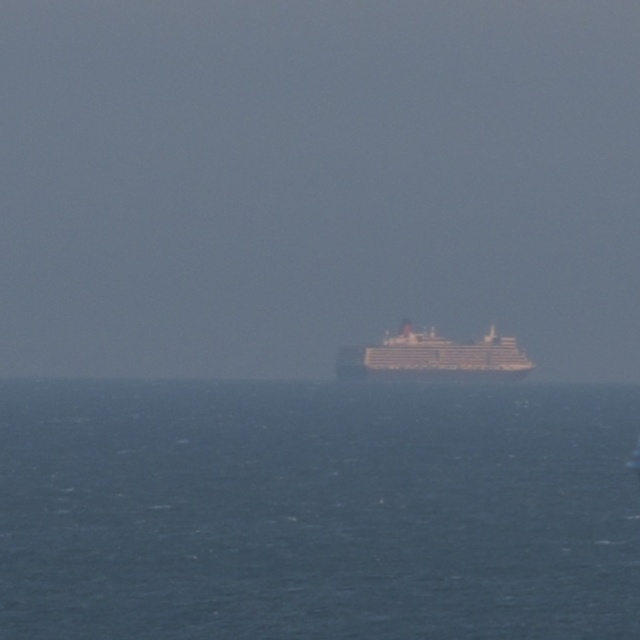
Question: Is blue water at center wider than white glossy ship at center?

Choices:
 (A) no
 (B) yes

Answer: (B)

Question: In this image, where is blue water at center located relative to white glossy ship at center?

Choices:
 (A) right
 (B) left

Answer: (B)

Question: Is blue water at center below white glossy ship at center?

Choices:
 (A) no
 (B) yes

Answer: (B)

Question: Which object is farther from the camera taking this photo?

Choices:
 (A) white glossy ship at center
 (B) blue water at center

Answer: (A)

Question: Which point is farther to the camera?

Choices:
 (A) (426, 380)
 (B) (321, 401)

Answer: (A)